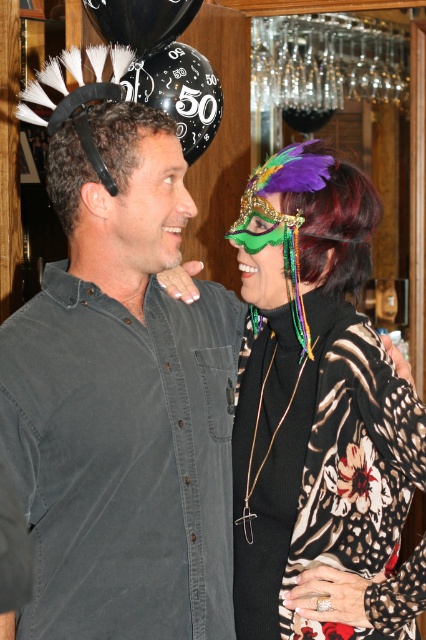
Question: Which of the following is the closest to the observer?

Choices:
 (A) dark gray shirt at center
 (B) green feathered mask at upper right

Answer: (A)

Question: Based on their relative distances, which object is nearer to the floral-patterned fabric at center?

Choices:
 (A) shiny green mask at center
 (B) green feathered mask at upper right
 (C) dark gray shirt at center

Answer: (A)

Question: Is dark gray shirt at center below floral-patterned fabric at center?

Choices:
 (A) no
 (B) yes

Answer: (A)

Question: Which object appears farthest from the camera in this image?

Choices:
 (A) dark gray shirt at center
 (B) shiny green mask at center

Answer: (B)

Question: Does shiny green mask at center have a larger size compared to green feathered mask at upper right?

Choices:
 (A) yes
 (B) no

Answer: (A)

Question: Is dark gray shirt at center further to the viewer compared to green feathered mask at upper right?

Choices:
 (A) no
 (B) yes

Answer: (A)